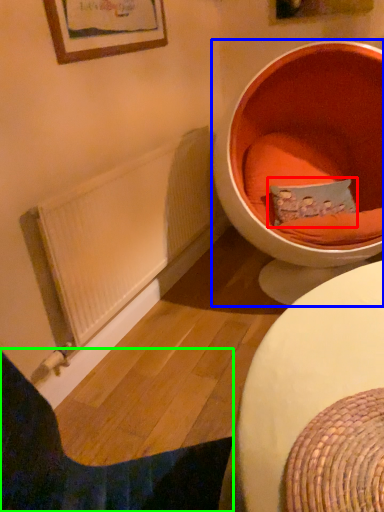
Question: Which object is the farthest from pillow (highlighted by a red box)? Choose among these: toilet (highlighted by a blue box) or furniture (highlighted by a green box).

Choices:
 (A) toilet
 (B) furniture

Answer: (B)